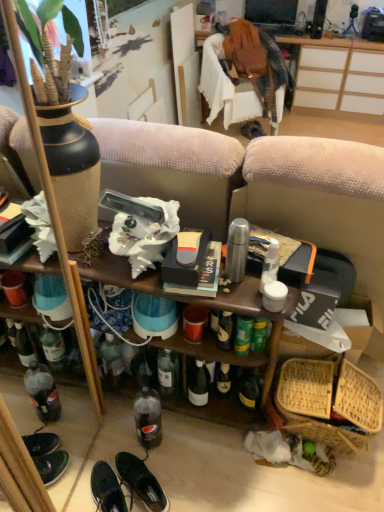
Question: Could you tell me if shiny black sneakers at lower left, the first footwear when ordered from left to right, is facing bamboo woven basket at lower right?

Choices:
 (A) yes
 (B) no

Answer: (B)

Question: From the image's perspective, does shiny black sneakers at lower left, the first footwear when ordered from left to right, appear higher than bamboo woven basket at lower right?

Choices:
 (A) no
 (B) yes

Answer: (A)

Question: Considering the relative positions of shiny black sneakers at lower left, the second footwear positioned from the right, and bamboo woven basket at lower right in the image provided, is shiny black sneakers at lower left, the second footwear positioned from the right, to the right of bamboo woven basket at lower right from the viewer's perspective?

Choices:
 (A) yes
 (B) no

Answer: (B)

Question: Is shiny black sneakers at lower left, the first footwear when ordered from left to right, shorter than bamboo woven basket at lower right?

Choices:
 (A) yes
 (B) no

Answer: (A)

Question: Is shiny black sneakers at lower left, the second footwear positioned from the right, further to the viewer compared to bamboo woven basket at lower right?

Choices:
 (A) no
 (B) yes

Answer: (A)

Question: From a real-world perspective, is shiny black sneakers at lower left, the first footwear when ordered from left to right, on bamboo woven basket at lower right?

Choices:
 (A) no
 (B) yes

Answer: (A)

Question: Is clear plastic bottle at lower center positioned in front of wooden shelf at center?

Choices:
 (A) no
 (B) yes

Answer: (A)

Question: Does clear plastic bottle at lower center have a lesser width compared to wooden shelf at center?

Choices:
 (A) no
 (B) yes

Answer: (B)

Question: From a real-world perspective, does clear plastic bottle at lower center sit lower than wooden shelf at center?

Choices:
 (A) yes
 (B) no

Answer: (A)

Question: Is clear plastic bottle at lower center shorter than wooden shelf at center?

Choices:
 (A) yes
 (B) no

Answer: (A)

Question: Considering the relative sizes of clear plastic bottle at lower center and wooden shelf at center in the image provided, is clear plastic bottle at lower center taller than wooden shelf at center?

Choices:
 (A) no
 (B) yes

Answer: (A)

Question: Would you consider clear plastic bottle at lower center to be distant from wooden shelf at center?

Choices:
 (A) yes
 (B) no

Answer: (B)

Question: From the image's perspective, does bamboo woven basket at lower right appear lower than black leather shoes at lower center, which appears as the 2th footwear when viewed from the left?

Choices:
 (A) no
 (B) yes

Answer: (A)